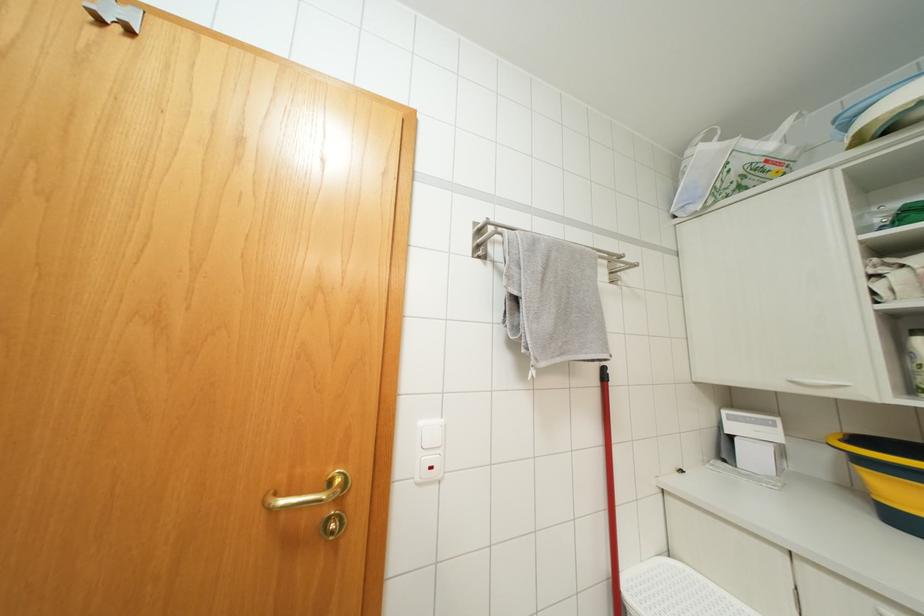
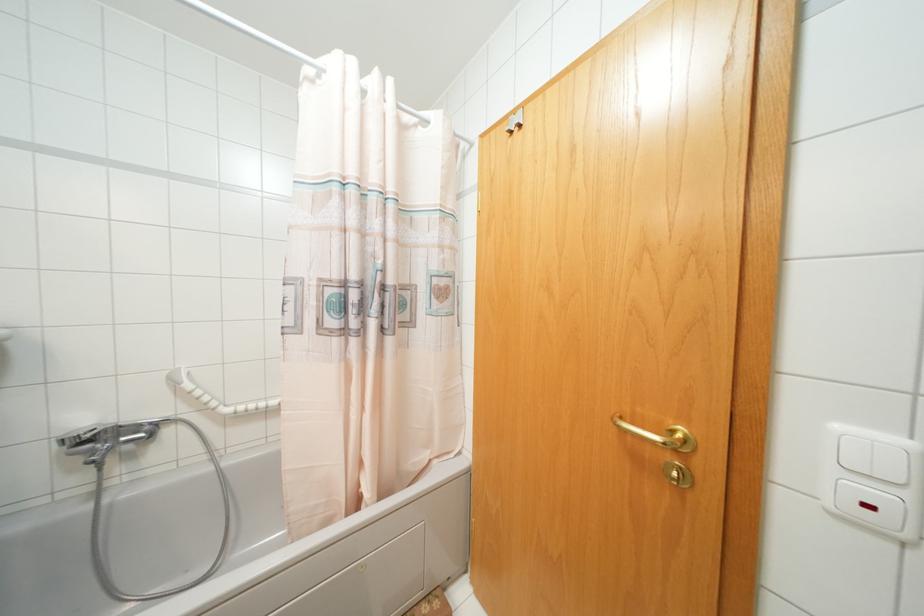
Where in the second image is the point corresponding to point 441,421 from the first image?

(906, 442)